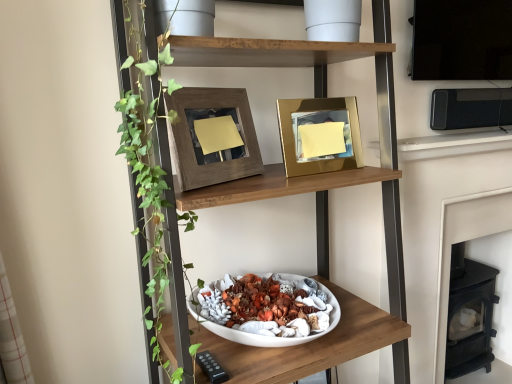
Question: Is point (323, 248) positioned closer to the camera than point (433, 100)?

Choices:
 (A) closer
 (B) farther

Answer: (A)

Question: Is wooden bowl at center, which is counted as the second shelf, starting from the bottom, inside or outside of black plastic microwave at upper right?

Choices:
 (A) outside
 (B) inside

Answer: (A)

Question: Estimate the real-world distances between objects in this image. Which object is closer to the black plastic microwave at upper right?

Choices:
 (A) wooden frame at upper center, which ranks as the first picture frame in left-to-right order
 (B) white matte bowl at center, which appears as the second shelf when viewed from the top
 (C) black cast iron fireplace at lower right
 (D) gold metallic picture frame at upper center, the second picture frame when ordered from left to right
 (E) wooden bowl at center, marked as the first shelf in a top-to-bottom arrangement

Answer: (C)

Question: Which object is the farthest from the gold metallic picture frame at upper center, the second picture frame when ordered from left to right?

Choices:
 (A) wooden bowl at center, marked as the first shelf in a top-to-bottom arrangement
 (B) black plastic microwave at upper right
 (C) white matte bowl at center, which is counted as the first shelf, starting from the bottom
 (D) wooden frame at upper center, which appears as the second picture frame when viewed from the right
 (E) black cast iron fireplace at lower right

Answer: (E)